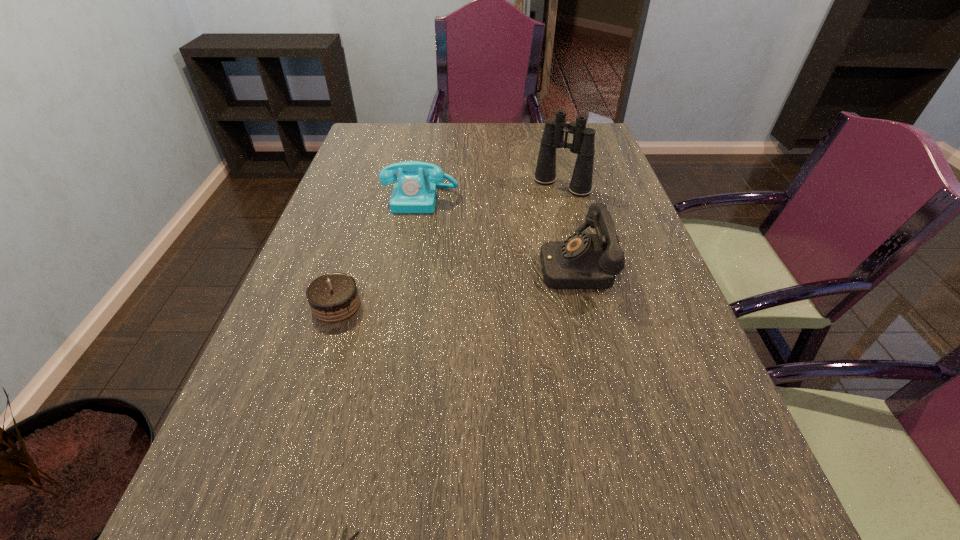
Where is `free space located on the dial of the shorter telephone`? free space located on the dial of the shorter telephone is located at coordinates (408, 274).

Where is `blank area located 0.300m on the back of the chocolate cake`? blank area located 0.300m on the back of the chocolate cake is located at coordinates (367, 213).

Where is `telephone present at the left edge`? telephone present at the left edge is located at coordinates (415, 192).

What are the coordinates of `chocolate cake at the left edge` in the screenshot? It's located at (333, 297).

Where is `binoculars present at the right edge`? The image size is (960, 540). binoculars present at the right edge is located at coordinates (583, 139).

The width and height of the screenshot is (960, 540). I want to click on telephone that is at the right edge, so click(x=583, y=261).

Where is `vacant area at the far edge`? This screenshot has height=540, width=960. vacant area at the far edge is located at coordinates (435, 149).

Identify the location of blank space at the left edge. 324,346.

Find the location of a particular element. free space at the right edge of the desktop is located at coordinates pyautogui.click(x=638, y=266).

This screenshot has width=960, height=540. In the image, there is a desktop. Identify the location of free space at the far left corner. (382, 137).